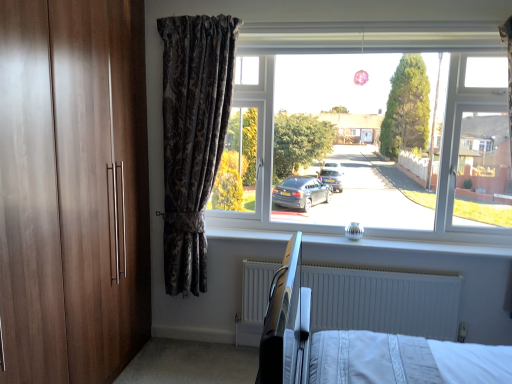
Question: Considering the positions of silver metallic knob at center and white textured radiator at lower center in the image, is silver metallic knob at center bigger or smaller than white textured radiator at lower center?

Choices:
 (A) small
 (B) big

Answer: (A)

Question: In the image, is silver metallic knob at center positioned in front of or behind white textured radiator at lower center?

Choices:
 (A) front
 (B) behind

Answer: (A)

Question: Estimate the real-world distances between objects in this image. Which object is farther from the metallic hospital bed at center?

Choices:
 (A) transparent glass window at center
 (B) white textured radiator at lower center
 (C) silver metallic knob at center
 (D) dark floral fabric curtain at center

Answer: (D)

Question: Estimate the real-world distances between objects in this image. Which object is closer to the transparent glass window at center?

Choices:
 (A) silver metallic knob at center
 (B) metallic hospital bed at center
 (C) white textured radiator at lower center
 (D) dark floral fabric curtain at center

Answer: (A)